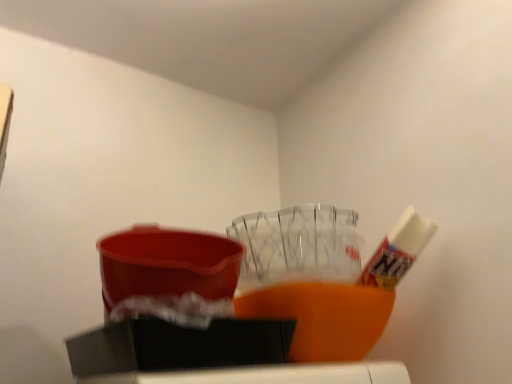
What do you see at coordinates (398, 251) in the screenshot? I see `white glossy tube at upper right` at bounding box center [398, 251].

From the picture: Measure the distance between white glossy tube at upper right and camera.

white glossy tube at upper right and camera are 28.38 inches apart from each other.

Locate an element on the screen. The width and height of the screenshot is (512, 384). white glossy tube at upper right is located at coordinates (398, 251).

Image resolution: width=512 pixels, height=384 pixels. What do you see at coordinates (168, 274) in the screenshot? I see `matte plastic basin at center` at bounding box center [168, 274].

The width and height of the screenshot is (512, 384). Identify the location of matte plastic basin at center. (168, 274).

Where is `white glossy tube at upper right`? white glossy tube at upper right is located at coordinates (398, 251).

Visually, is matte plastic basin at center positioned to the left or to the right of white glossy tube at upper right?

Clearly, matte plastic basin at center is on the left of white glossy tube at upper right in the image.

Between matte plastic basin at center and white glossy tube at upper right, which one is positioned behind?

white glossy tube at upper right is more distant.

Considering the points (189, 279) and (409, 213), which point is behind, point (189, 279) or point (409, 213)?

Point (409, 213)

From the image's perspective, is matte plastic basin at center located beneath white glossy tube at upper right?

No, from the image's perspective, matte plastic basin at center is not beneath white glossy tube at upper right.

From a real-world perspective, who is located higher, matte plastic basin at center or white glossy tube at upper right?

In real-world perspective, white glossy tube at upper right is above.

Which object is thinner, matte plastic basin at center or white glossy tube at upper right?

white glossy tube at upper right.

Can you confirm if matte plastic basin at center is taller than white glossy tube at upper right?

In fact, matte plastic basin at center may be shorter than white glossy tube at upper right.

Is matte plastic basin at center bigger than white glossy tube at upper right?

Correct, matte plastic basin at center is larger in size than white glossy tube at upper right.

Is matte plastic basin at center spatially inside white glossy tube at upper right, or outside of it?

matte plastic basin at center is located beyond the bounds of white glossy tube at upper right.

Is there a large distance between matte plastic basin at center and white glossy tube at upper right?

No, there isn't a large distance between matte plastic basin at center and white glossy tube at upper right.

Looking at this image, is white glossy tube at upper right at the back of matte plastic basin at center?

No.

From the picture: How many degrees apart are the facing directions of matte plastic basin at center and white glossy tube at upper right?

The facing directions of matte plastic basin at center and white glossy tube at upper right are 3.4 degrees apart.

At what (x,y) coordinates should I click in order to perform the action: click on basin that appears in front of the white glossy tube at upper right. Please return your answer as a coordinate pair (x, y). This screenshot has height=384, width=512. Looking at the image, I should click on (168, 274).

Which is more to the left, white glossy tube at upper right or matte plastic basin at center?

matte plastic basin at center.

Which object is further away from the camera taking this photo, white glossy tube at upper right or matte plastic basin at center?

white glossy tube at upper right.

Which is in front, point (399, 221) or point (131, 236)?

The point (131, 236) is closer.

From the image's perspective, is white glossy tube at upper right positioned above or below matte plastic basin at center?

white glossy tube at upper right is situated lower than matte plastic basin at center in the image.

From a real-world perspective, between white glossy tube at upper right and matte plastic basin at center, who is vertically lower?

In real-world perspective, matte plastic basin at center is lower.

Which of these two, white glossy tube at upper right or matte plastic basin at center, is thinner?

Thinner between the two is white glossy tube at upper right.

Considering the sizes of objects white glossy tube at upper right and matte plastic basin at center in the image provided, who is shorter, white glossy tube at upper right or matte plastic basin at center?

matte plastic basin at center is shorter.

Based on their sizes in the image, would you say white glossy tube at upper right is bigger or smaller than matte plastic basin at center?

Considering their sizes, white glossy tube at upper right takes up less space than matte plastic basin at center.

Can we say white glossy tube at upper right lies outside matte plastic basin at center?

Yes.

Is the surface of white glossy tube at upper right in direct contact with matte plastic basin at center?

No, white glossy tube at upper right is not with matte plastic basin at center.

Is white glossy tube at upper right oriented away from matte plastic basin at center?

That's not correct — white glossy tube at upper right is not looking away from matte plastic basin at center.

Measure the distance from white glossy tube at upper right to matte plastic basin at center.

They are 33.08 centimeters apart.

Where is `basin located above the white glossy tube at upper right (from the image's perspective)`? Image resolution: width=512 pixels, height=384 pixels. basin located above the white glossy tube at upper right (from the image's perspective) is located at coordinates (168, 274).

This screenshot has height=384, width=512. What are the coordinates of `basin to the left of white glossy tube at upper right` in the screenshot? It's located at (168, 274).

Where is `toothpaste behind the matte plastic basin at center`? Image resolution: width=512 pixels, height=384 pixels. toothpaste behind the matte plastic basin at center is located at coordinates (398, 251).